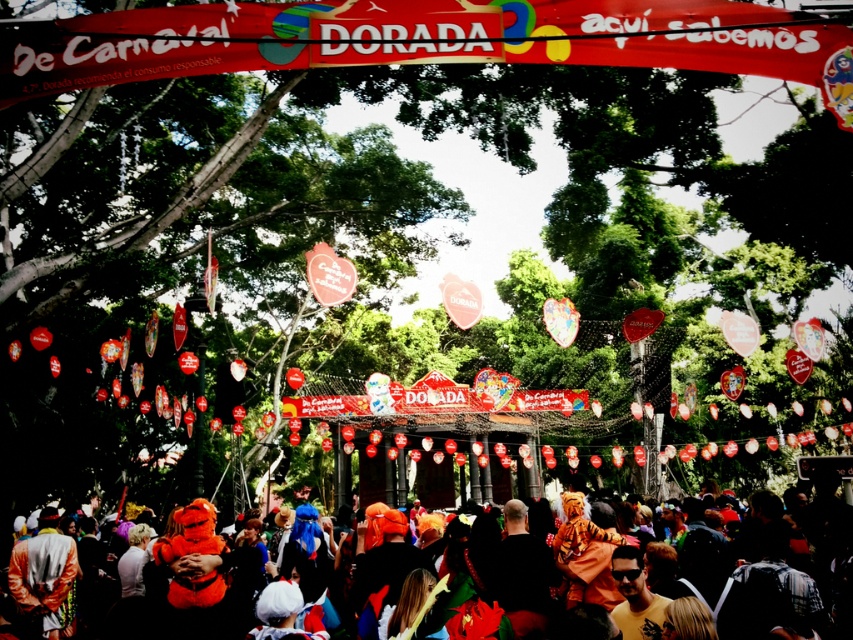
Which is below, red fabric banner at upper center or multicolored costumes at center?

Positioned lower is multicolored costumes at center.

In the scene shown: Is red fabric banner at upper center shorter than multicolored costumes at center?

Correct, red fabric banner at upper center is not as tall as multicolored costumes at center.

Identify the location of red fabric banner at upper center. (422, 40).